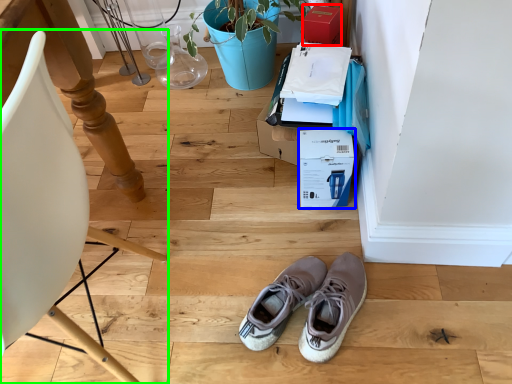
Question: Which object is positioned farthest from cardboard box (highlighted by a red box)? Select from cardboard box (highlighted by a blue box) and chair (highlighted by a green box).

Choices:
 (A) cardboard box
 (B) chair

Answer: (B)